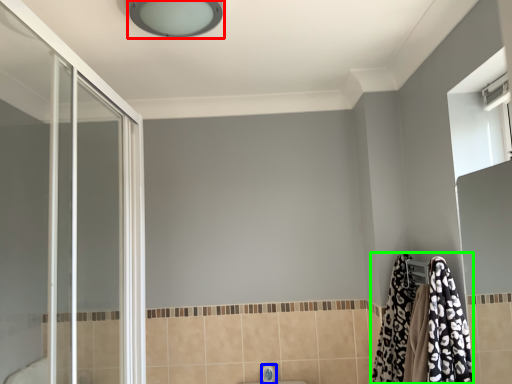
Question: Based on their relative distances, which object is farther from light fixture (highlighted by a red box)? Choose from faucet (highlighted by a blue box) and bathrobe (highlighted by a green box).

Choices:
 (A) faucet
 (B) bathrobe

Answer: (A)